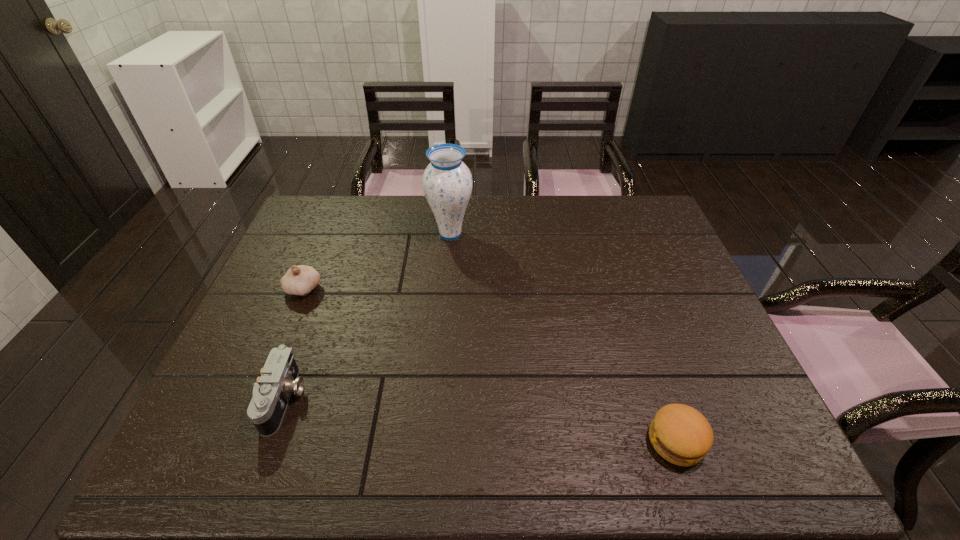
Find the location of a particular element. This screenshot has height=540, width=960. the farthest object is located at coordinates (447, 182).

Where is `the third object from left to right`? The image size is (960, 540). the third object from left to right is located at coordinates (447, 182).

Find the location of a particular element. The width and height of the screenshot is (960, 540). garlic is located at coordinates (299, 280).

Find the location of `camera`. camera is located at coordinates (279, 378).

This screenshot has width=960, height=540. Find the location of `hamburger`. hamburger is located at coordinates (680, 434).

Image resolution: width=960 pixels, height=540 pixels. Identify the location of vacant area situated on the right of the farthest object. (569, 234).

Image resolution: width=960 pixels, height=540 pixels. I want to click on free region located on the right of the third nearest object, so click(x=372, y=289).

Identify the location of blank space located 0.060m on the lens of the camera. [x=329, y=399].

At what (x,y) coordinates should I click in order to perform the action: click on vacant area situated on the left of the hamburger. Please return your answer as a coordinate pair (x, y). Looking at the image, I should click on (460, 441).

Identify the location of object present at the far edge. The height and width of the screenshot is (540, 960). (447, 182).